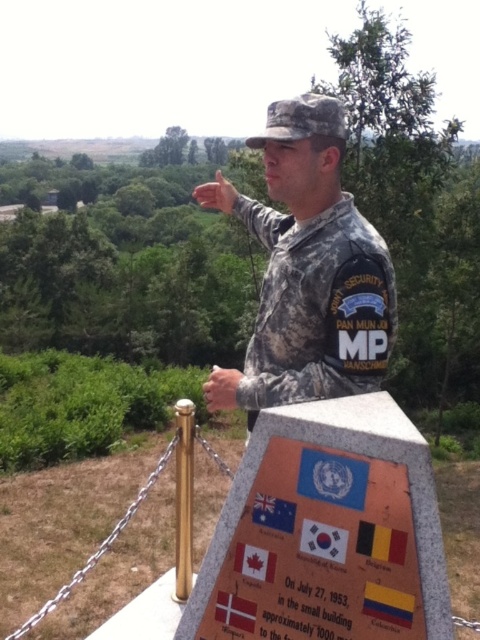
Between camouflage uniform at center and yellowmaterial/textureflag at right, which one appears on the right side from the viewer's perspective?

yellowmaterial/textureflag at right

Which is in front, point (388, 285) or point (381, 600)?

Point (381, 600) is in front.

The image size is (480, 640). Find the location of `camouflage uniform at center`. camouflage uniform at center is located at coordinates (308, 269).

Is camouflage uniform at center above white fabric flag at center?

Yes, camouflage uniform at center is above white fabric flag at center.

Who is positioned more to the left, camouflage uniform at center or white fabric flag at center?

white fabric flag at center is more to the left.

Does point (274, 401) come in front of point (245, 621)?

No, it is not.

Identify the location of camouflage uniform at center. The height and width of the screenshot is (640, 480). (308, 269).

Is yellowmaterial/textureflag at right behind white fabric flag at center?

That is False.

Between yellowmaterial/textureflag at right and white fabric flag at center, which one appears on the right side from the viewer's perspective?

yellowmaterial/textureflag at right is more to the right.

Between point (373, 605) and point (236, 616), which one is positioned in front?

Point (373, 605)

Locate an element on the screen. The height and width of the screenshot is (640, 480). yellowmaterial/textureflag at right is located at coordinates (387, 604).